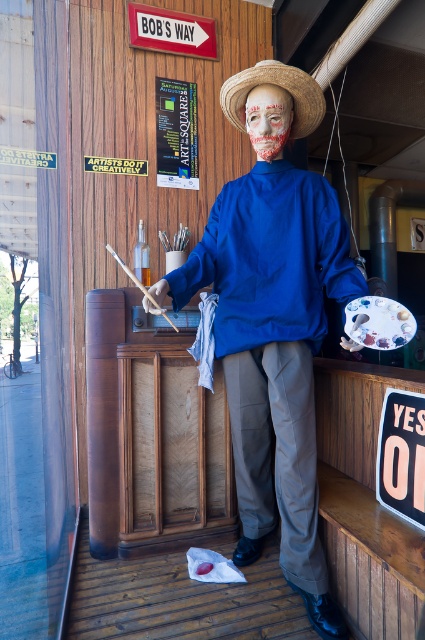
You are an artist trying to decide what to wear for a painting event. You have a matte blue shirt at center and a strawhat at center. Which item would you choose to cover more of your body?

The matte blue shirt at center is bigger than the strawhat at center, so it would cover more of your body.

You are an art student passing by the storefront and notice the matte blue shirt at center and the strawhat at center. Which item is located to the left of the other?

The matte blue shirt at center is positioned on the left side of strawhat at center.